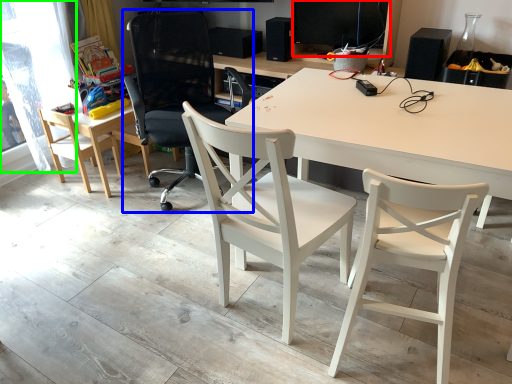
Question: Which object is positioned farthest from computer monitor (highlighted by a red box)? Select from chair (highlighted by a blue box) and window screen (highlighted by a green box).

Choices:
 (A) chair
 (B) window screen

Answer: (B)